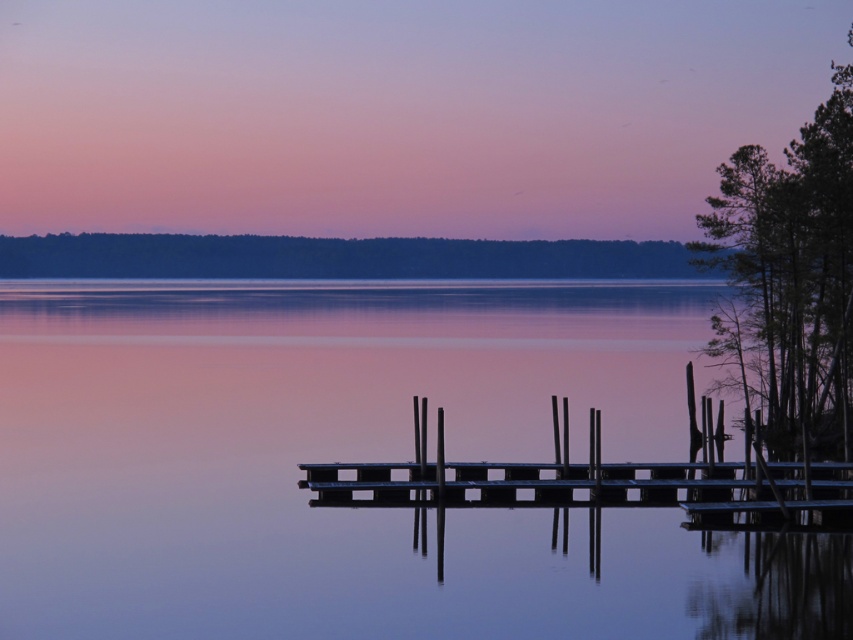
Is smooth water at center closer to camera compared to metallic dock at center?

Yes, it is in front of metallic dock at center.

Is point (38, 304) positioned in front of point (746, 499)?

That is False.

Where is `smooth water at center`? smooth water at center is located at coordinates (357, 460).